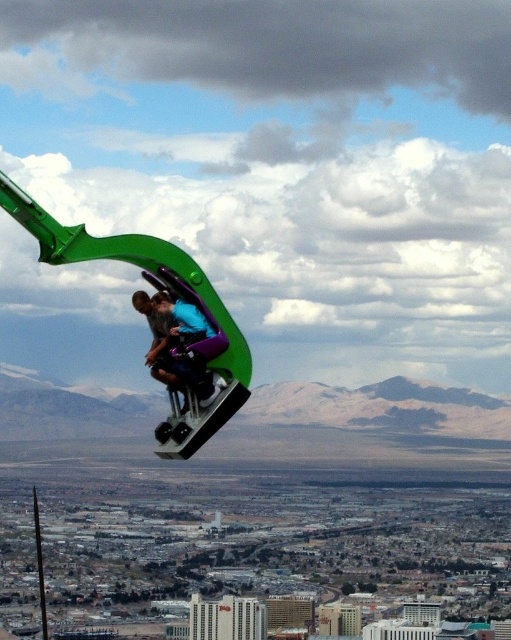
Question: Is green matte parachute at center closer to camera compared to blue fabric person at center?

Choices:
 (A) yes
 (B) no

Answer: (A)

Question: Is green matte parachute at center smaller than blue fabric person at center?

Choices:
 (A) no
 (B) yes

Answer: (A)

Question: Is green matte parachute at center below blue fabric person at center?

Choices:
 (A) yes
 (B) no

Answer: (B)

Question: Which object is farther from the camera taking this photo?

Choices:
 (A) blue fabric person at center
 (B) green matte parachute at center

Answer: (A)

Question: Which of the following is the farthest from the observer?

Choices:
 (A) blue fabric person at center
 (B) green matte parachute at center

Answer: (A)